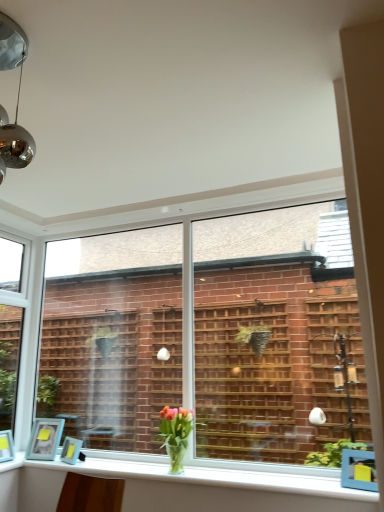
Where is `free spot to the right of translucent glass vase at lower center`? This screenshot has height=512, width=384. free spot to the right of translucent glass vase at lower center is located at coordinates (221, 469).